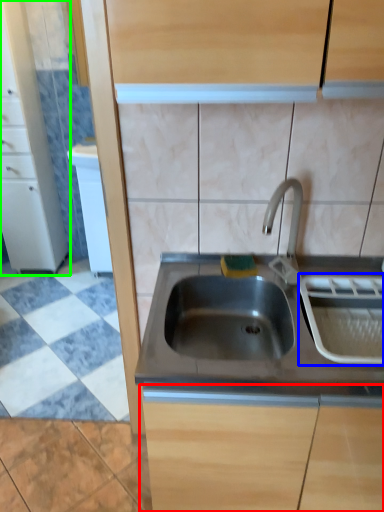
Question: Which object is positioned farthest from cabinetry (highlighted by a red box)? Select from appliance (highlighted by a blue box) and cabinetry (highlighted by a green box).

Choices:
 (A) appliance
 (B) cabinetry

Answer: (B)